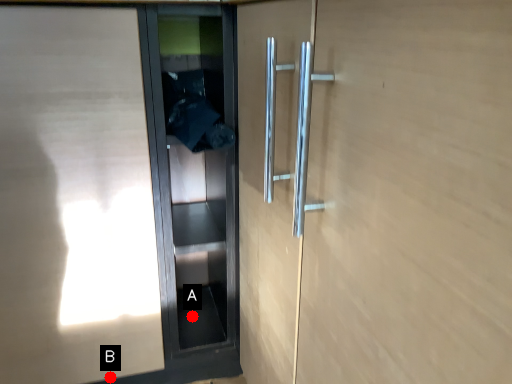
Question: Two points are circled on the image, labeled by A and B beside each circle. Which point is farther to the camera?

Choices:
 (A) A is further
 (B) B is further

Answer: (A)